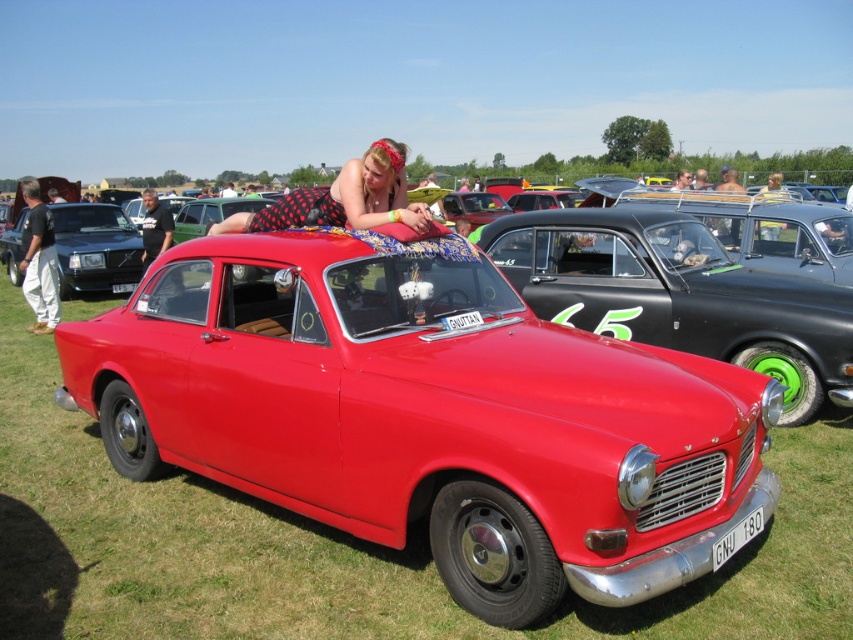
Question: Which point is farther from the camera taking this photo?

Choices:
 (A) pos(213,625)
 (B) pos(383,154)
 (C) pos(585,252)
 (D) pos(80,285)

Answer: (D)

Question: Is polka dot fabric at center above shiny black car at left?

Choices:
 (A) yes
 (B) no

Answer: (B)

Question: Does green grass at center appear on the left side of shiny black car at left?

Choices:
 (A) no
 (B) yes

Answer: (A)

Question: Does shiny red car at center appear under shiny black car at left?

Choices:
 (A) yes
 (B) no

Answer: (A)

Question: Which of these objects is positioned closest to the shiny red car at center?

Choices:
 (A) polka dot fabric at center
 (B) green grass at center
 (C) shiny black car at left

Answer: (A)

Question: Among these objects, which one is nearest to the camera?

Choices:
 (A) shiny black car at left
 (B) green grass at center

Answer: (B)